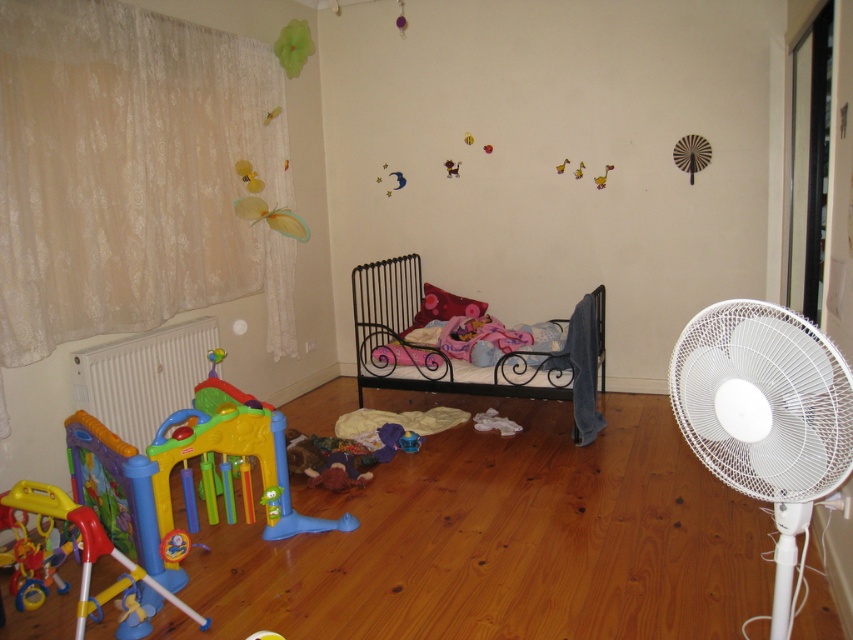
Question: Which of the following is the closest to the observer?

Choices:
 (A) (380, 291)
 (B) (74, 355)

Answer: (B)

Question: Does white lace curtain at left appear on the right side of plastic/soft walker at lower left?

Choices:
 (A) yes
 (B) no

Answer: (B)

Question: Which of these objects is positioned farthest from the white plastic fan at right?

Choices:
 (A) plastic/soft walker at lower left
 (B) black wrought iron bed at center

Answer: (A)

Question: Is plastic/soft walker at lower left to the right of pink fabric pillow at center from the viewer's perspective?

Choices:
 (A) no
 (B) yes

Answer: (A)

Question: Which is farther from the plastic/soft walker at lower left?

Choices:
 (A) pink fabric pillow at center
 (B) multicolored plastic playpen at lower left

Answer: (A)

Question: Can you confirm if white lace curtain at left is positioned above plastic/soft walker at lower left?

Choices:
 (A) yes
 (B) no

Answer: (A)